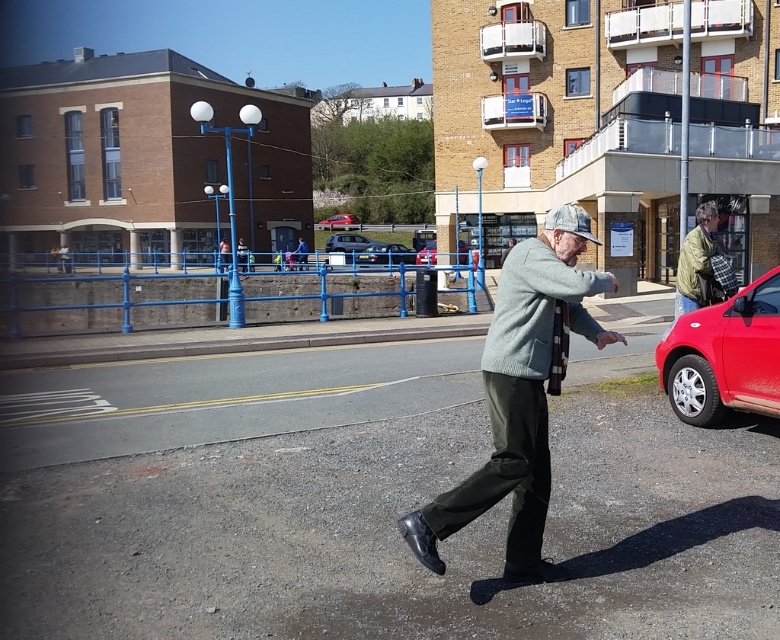
You are a delivery person needing to park your 1.8 meter wide van between the metallic gray hatchback at center and the metallic silver car at center. Can you fit your van there?

The metallic gray hatchback at center might be wider than the metallic silver car at center, but without knowing the exact widths, it is uncertain if there is enough space to fit a 1.8 meter wide van between them.

You are standing at the point with coordinates point (690, 301) and want to walk to the point with coordinates point (355, 237). Which direction should you face to walk directly towards your destination?

You should face north because point (690, 301) is in front of point (355, 237), so walking north will take you directly there.